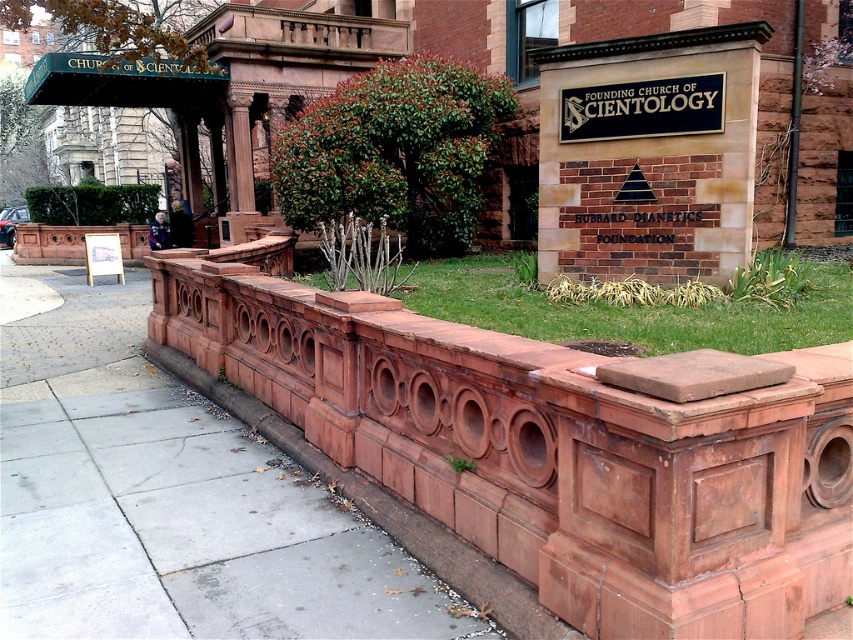
Between terracotta stone curb at lower center and black metal sign at upper center, which one is positioned lower?

Positioned lower is terracotta stone curb at lower center.

Which is more to the right, terracotta stone curb at lower center or black metal sign at upper center?

black metal sign at upper center is more to the right.

What do you see at coordinates (383, 509) in the screenshot?
I see `terracotta stone curb at lower center` at bounding box center [383, 509].

I want to click on terracotta stone curb at lower center, so click(383, 509).

Can you confirm if terracotta stone curb at lower center is positioned to the right of white wood sign at center?

Correct, you'll find terracotta stone curb at lower center to the right of white wood sign at center.

Between terracotta stone curb at lower center and white wood sign at center, which one appears on the right side from the viewer's perspective?

From the viewer's perspective, terracotta stone curb at lower center appears more on the right side.

Which is in front, point (242, 392) or point (108, 250)?

Point (242, 392)

The width and height of the screenshot is (853, 640). In order to click on terracotta stone curb at lower center in this screenshot , I will do `click(383, 509)`.

Between black metal sign at upper center and white wood sign at center, which one is positioned higher?

Positioned higher is black metal sign at upper center.

Find the location of a particular element. The image size is (853, 640). black metal sign at upper center is located at coordinates (642, 108).

Find the location of `black metal sign at upper center`. black metal sign at upper center is located at coordinates (642, 108).